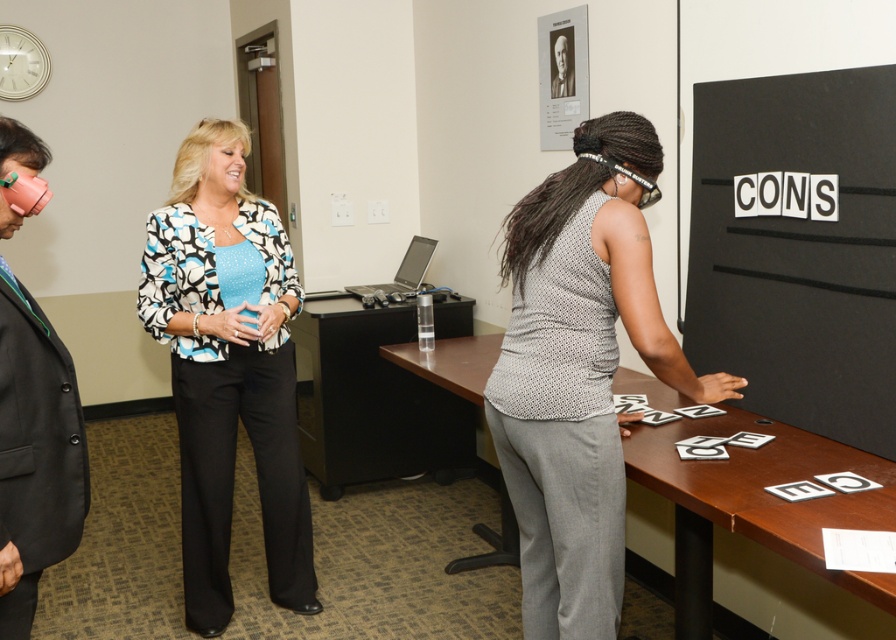
Is point (586, 468) positioned before point (347, 461)?

Yes, it is.

Can you confirm if gray textured shirt at center is positioned above black wood table at center?

Correct, gray textured shirt at center is located above black wood table at center.

Identify the location of gray textured shirt at center. The height and width of the screenshot is (640, 896). (579, 371).

This screenshot has height=640, width=896. Find the location of `gray textured shirt at center`. gray textured shirt at center is located at coordinates (579, 371).

Does black matte board at right come in front of printed fabric blouse at center?

Yes, black matte board at right is in front of printed fabric blouse at center.

Which is behind, point (817, 406) or point (210, 403)?

The point (210, 403) is more distant.

This screenshot has height=640, width=896. I want to click on black matte board at right, so click(798, 252).

How much distance is there between black matte board at right and black suit at left?

black matte board at right is 6.85 feet away from black suit at left.

Is black matte board at right shorter than black suit at left?

No.

What do you see at coordinates (798, 252) in the screenshot? The height and width of the screenshot is (640, 896). I see `black matte board at right` at bounding box center [798, 252].

This screenshot has width=896, height=640. I want to click on black matte board at right, so click(x=798, y=252).